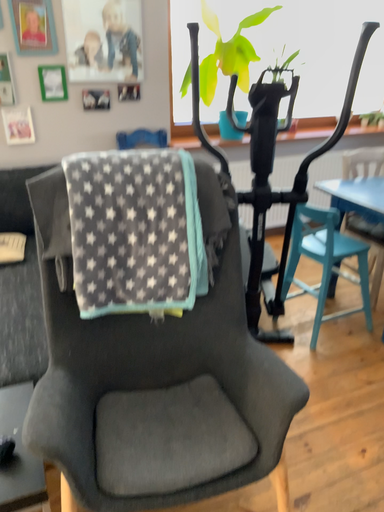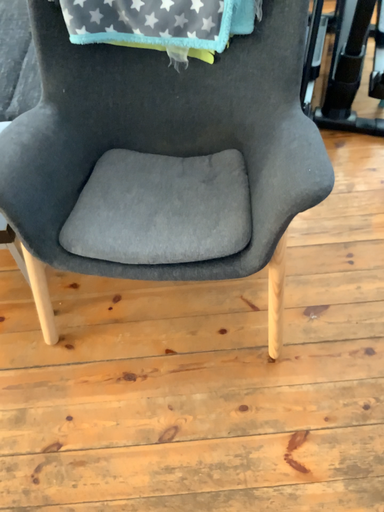
Question: Which way did the camera rotate in the video?

Choices:
 (A) rotated left
 (B) rotated right

Answer: (A)